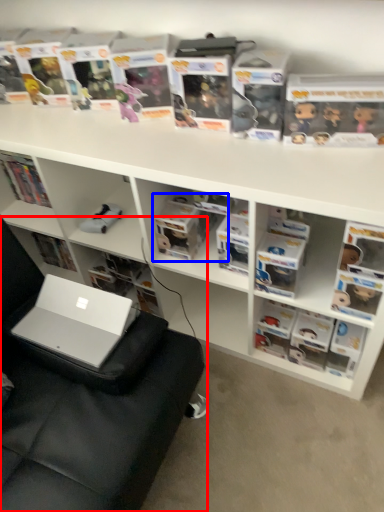
Question: Which object appears closest to the camera in this image, swivel chair (highlighted by a red box) or book (highlighted by a blue box)?

Choices:
 (A) swivel chair
 (B) book

Answer: (A)